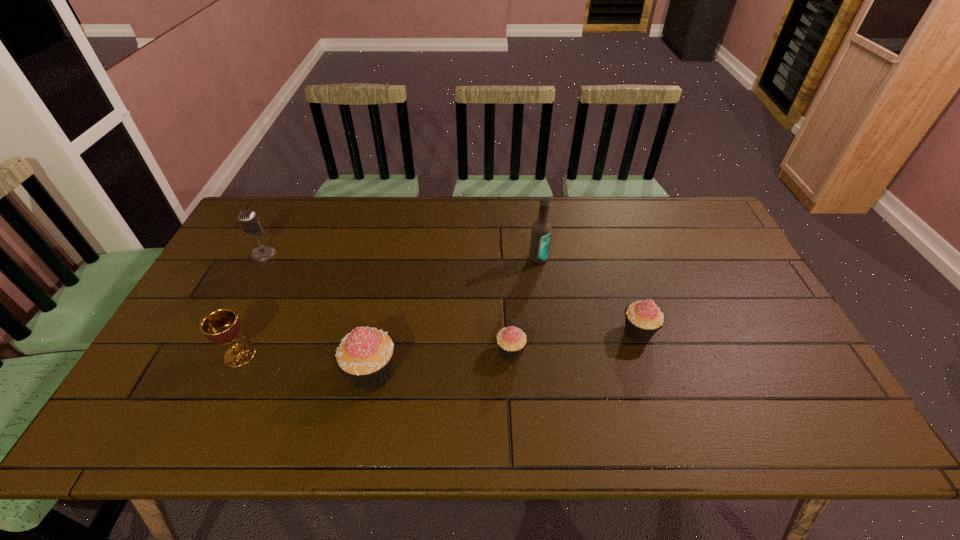
The width and height of the screenshot is (960, 540). I want to click on empty location between the second tallest cupcake and the microphone, so click(451, 293).

I want to click on unoccupied area between the chalice and the leftmost cupcake, so pos(306,364).

Locate an element on the screen. vacant area that lies between the tallest object and the second shortest cupcake is located at coordinates (588, 295).

Where is `unoccupied area between the shortest object and the microphone`? unoccupied area between the shortest object and the microphone is located at coordinates [x=387, y=303].

This screenshot has width=960, height=540. What are the coordinates of `free spot between the tallest object and the second shortest cupcake` in the screenshot? It's located at (588, 295).

Identify which object is located as the fourth nearest to the beer bottle. Please provide its 2D coordinates. Your answer should be formatted as a tuple, i.e. [(x, y)], where the tuple contains the x and y coordinates of a point satisfying the conditions above.

[(222, 326)]

Identify which object is the nearest to the leftmost cupcake. Please provide its 2D coordinates. Your answer should be formatted as a tuple, i.e. [(x, y)], where the tuple contains the x and y coordinates of a point satisfying the conditions above.

[(511, 341)]

In order to click on cupcake that stands as the second closest to the microphone in this screenshot , I will do `click(511, 341)`.

Locate which cupcake ranks second in proximity to the chalice. Please provide its 2D coordinates. Your answer should be formatted as a tuple, i.e. [(x, y)], where the tuple contains the x and y coordinates of a point satisfying the conditions above.

[(511, 341)]

Where is `free space that satisfies the following two spatial constraints: 1. on the front side of the fourth object from left to right; 2. on the right side of the microphone`? free space that satisfies the following two spatial constraints: 1. on the front side of the fourth object from left to right; 2. on the right side of the microphone is located at coordinates (213, 352).